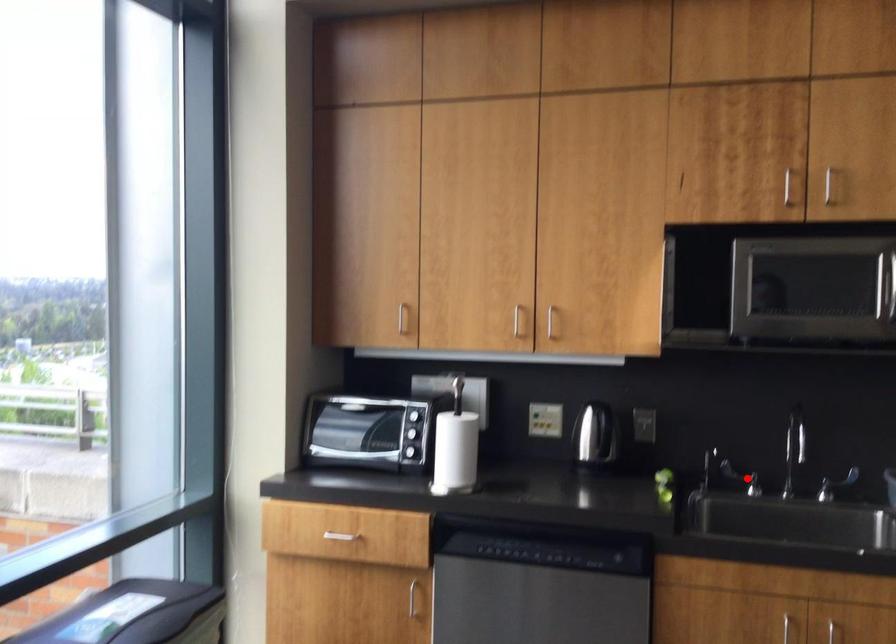
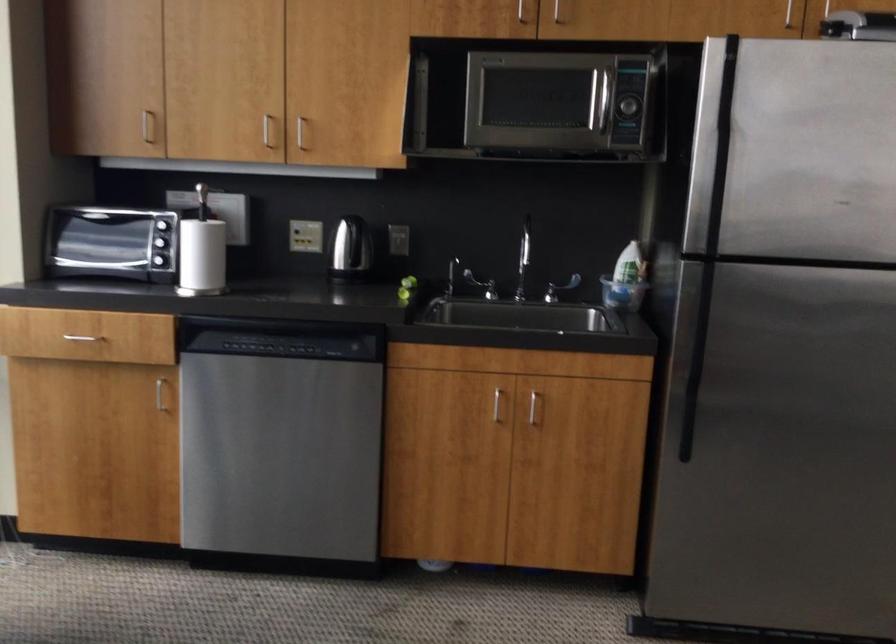
Where in the second image is the point corresponding to the highlighted location from the first image?

(480, 285)